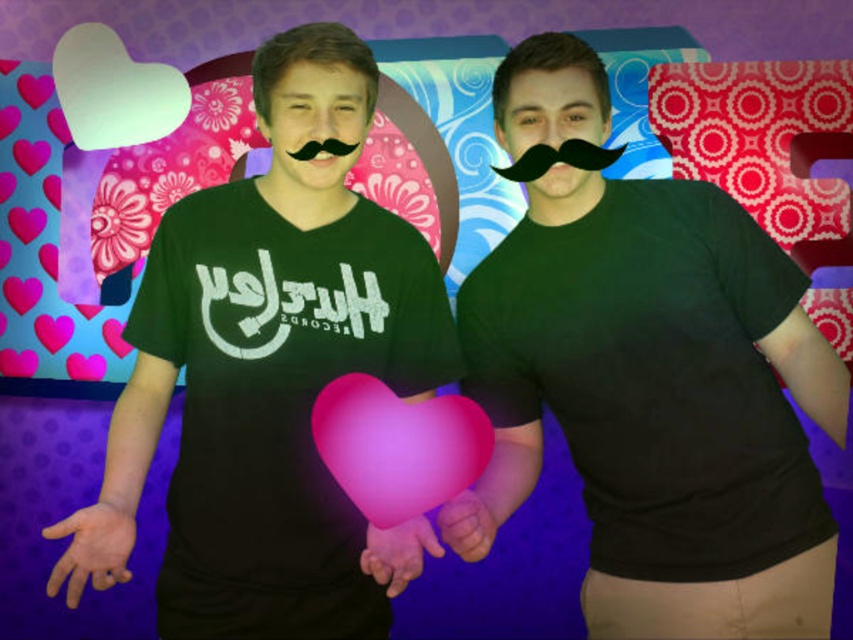
Question: From the image, what is the correct spatial relationship of pink rubber heart at center in relation to black fuzzy mustache at center?

Choices:
 (A) below
 (B) above

Answer: (A)

Question: Does black matte t-shirt at center have a lesser width compared to black fuzzy mustache at center?

Choices:
 (A) no
 (B) yes

Answer: (A)

Question: Which point is closer to the camera taking this photo?

Choices:
 (A) (335, 140)
 (B) (633, 355)
 (C) (338, 589)
 (D) (360, 477)

Answer: (D)

Question: Estimate the real-world distances between objects in this image. Which object is farther from the pink rubber heart at center?

Choices:
 (A) black matte t-shirt at center
 (B) black fuzzy mustache at center
 (C) green matte t-shirt at center

Answer: (B)

Question: Does black matte t-shirt at center appear on the left side of pink rubber heart at center?

Choices:
 (A) no
 (B) yes

Answer: (A)

Question: Which point appears closest to the camera in this image?

Choices:
 (A) (746, 474)
 (B) (335, 150)
 (C) (337, 448)

Answer: (C)